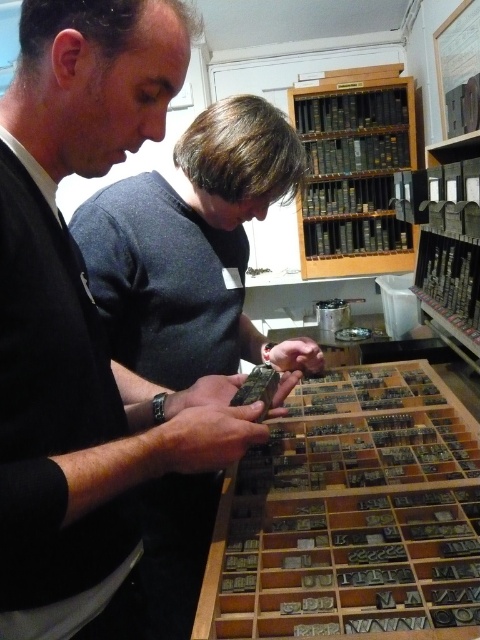
You are a visitor in the museum and want to take a photo of the wooden tray with the printing blocks. However, your phone is currently at the point labeled as point (79,308). Can you confirm if your phone is positioned at the center of the wooden tray?

The point (79,308) corresponds to the black matte phone at center, so yes, your phone is positioned at the center of the wooden tray.

You are an archivist trying to organize the metallic letterpress blocks at center and the wooden bookshelf at upper center into a storage area. Based on their sizes, which object should you place first to maximize space efficiency?

The metallic letterpress blocks at center has a lesser width compared to the wooden bookshelf at upper center, so you should place the wooden bookshelf at upper center first to utilize the space efficiently.